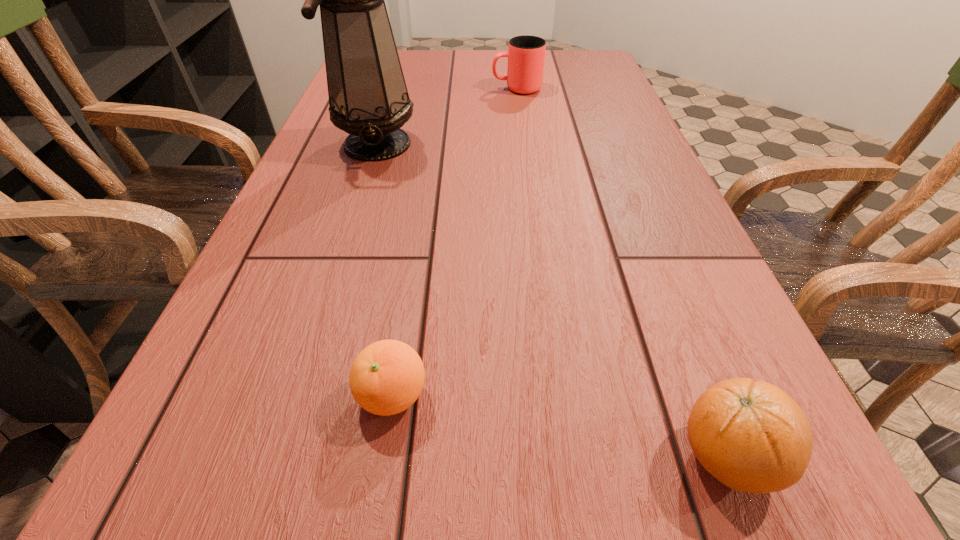
Image resolution: width=960 pixels, height=540 pixels. In order to click on unoccupied position between the shorter orange and the taller orange in this screenshot , I will do `click(560, 425)`.

Find the location of a particular element. The width and height of the screenshot is (960, 540). vacant area that lies between the shorter orange and the right orange is located at coordinates pyautogui.click(x=560, y=425).

Where is `unoccupied position between the tallest object and the taller orange`? The height and width of the screenshot is (540, 960). unoccupied position between the tallest object and the taller orange is located at coordinates (552, 299).

You are a GUI agent. You are given a task and a screenshot of the screen. Output one action in this format:
    pyautogui.click(x=<x>, y=<y>)
    Task: Click on the free space between the left orange and the oil lamp
    
    Given the screenshot: What is the action you would take?
    pyautogui.click(x=385, y=269)

Find the location of a particular element. Image resolution: width=960 pixels, height=540 pixels. vacant space that is in between the left orange and the farthest object is located at coordinates (455, 242).

Where is `vacant area between the taller orange and the farthest object`? The image size is (960, 540). vacant area between the taller orange and the farthest object is located at coordinates coord(621,272).

Where is `free space between the taller orange and the tallest object`? The image size is (960, 540). free space between the taller orange and the tallest object is located at coordinates (552, 299).

This screenshot has height=540, width=960. In order to click on blank region between the right orange and the left orange in this screenshot , I will do `click(560, 425)`.

Where is `empty space that is in between the shorter orange and the farthest object`? This screenshot has height=540, width=960. empty space that is in between the shorter orange and the farthest object is located at coordinates (455, 242).

Locate an element on the screen. The image size is (960, 540). vacant region between the second farthest object and the third object from left to right is located at coordinates (447, 116).